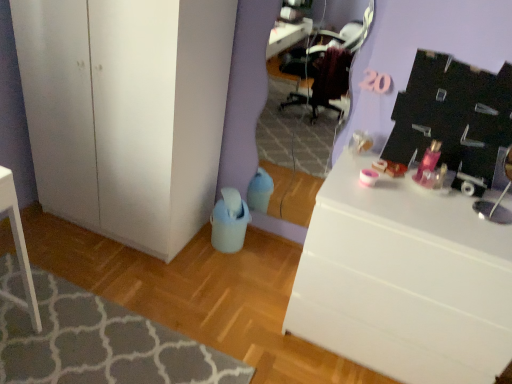
Identify the location of unoccupied region to the right of white matte cabinet at lower left. This screenshot has width=512, height=384. (234, 273).